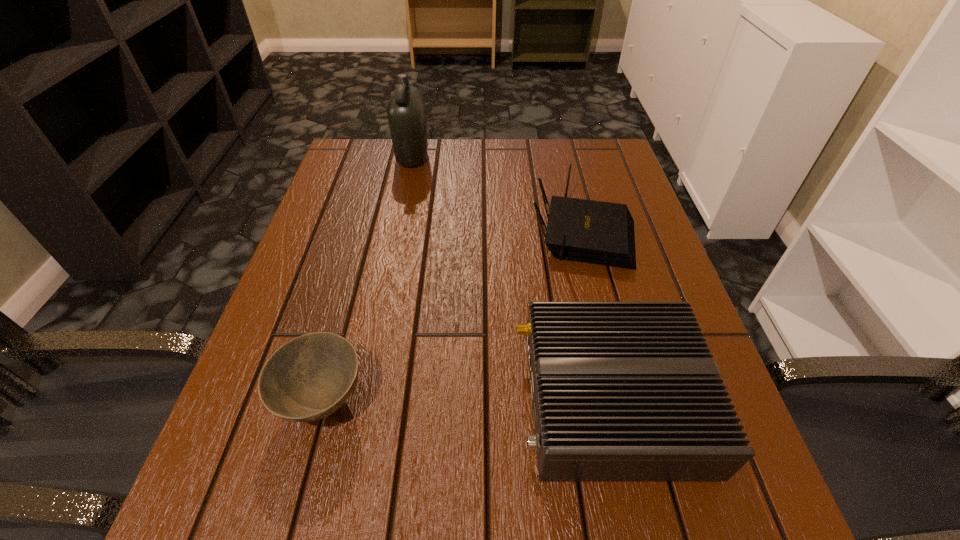
Identify the location of free space located 0.170m on the right of the bowl. (474, 401).

Locate an element on the screen. The width and height of the screenshot is (960, 540). object present at the far edge is located at coordinates (406, 113).

Locate an element on the screen. bottle present at the left edge is located at coordinates (406, 113).

Where is `bowl that is at the left edge`? The image size is (960, 540). bowl that is at the left edge is located at coordinates (308, 378).

You are a GUI agent. You are given a task and a screenshot of the screen. Output one action in this format:
    pyautogui.click(x=<x>, y=<y>)
    Task: Click on the object at the far left corner
    The image size is (960, 540).
    Given the screenshot: What is the action you would take?
    pyautogui.click(x=406, y=113)

This screenshot has height=540, width=960. I want to click on free space at the far edge of the desktop, so click(x=473, y=170).

Locate an element on the screen. free space at the near edge of the desktop is located at coordinates (532, 502).

At what (x,y) coordinates should I click in order to perform the action: click on vacant space at the left edge of the desktop. Please return your answer as a coordinate pair (x, y). Image resolution: width=960 pixels, height=540 pixels. Looking at the image, I should click on (364, 218).

In the image, there is a desktop. Identify the location of vacant space at the right edge. The height and width of the screenshot is (540, 960). (643, 217).

Identify the location of free space at the far left corner of the desktop. This screenshot has width=960, height=540. (378, 181).